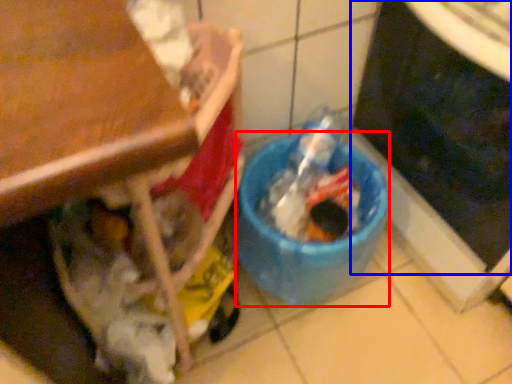
Question: Which object appears closest to the camera in this image, recycling bin (highlighted by a red box) or appliance (highlighted by a blue box)?

Choices:
 (A) recycling bin
 (B) appliance

Answer: (B)